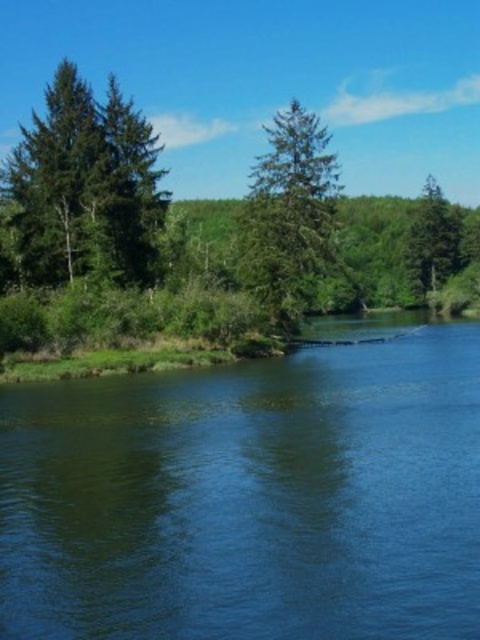
Question: Which of these objects is positioned farthest from the green matte tree at upper right?

Choices:
 (A) green matte tree at center
 (B) green matte tree at left
 (C) green grassy river at lower left

Answer: (C)

Question: Among these objects, which one is nearest to the camera?

Choices:
 (A) green grassy river at lower left
 (B) green matte tree at upper right
 (C) green matte tree at left
 (D) green matte tree at center

Answer: (A)

Question: Which object is the closest to the green matte tree at left?

Choices:
 (A) green matte tree at center
 (B) green grassy river at lower left
 (C) green matte tree at upper right

Answer: (A)

Question: In this image, where is green grassy river at lower left located relative to green matte tree at left?

Choices:
 (A) above
 (B) below

Answer: (B)

Question: Can you confirm if green grassy river at lower left is wider than green matte tree at upper right?

Choices:
 (A) no
 (B) yes

Answer: (B)

Question: Can you confirm if green matte tree at center is smaller than green matte tree at upper right?

Choices:
 (A) yes
 (B) no

Answer: (B)